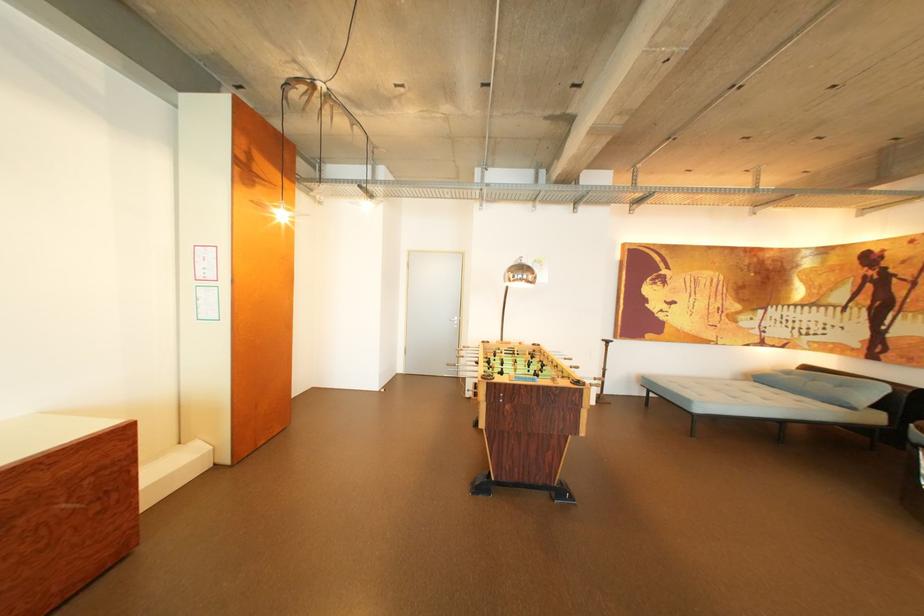
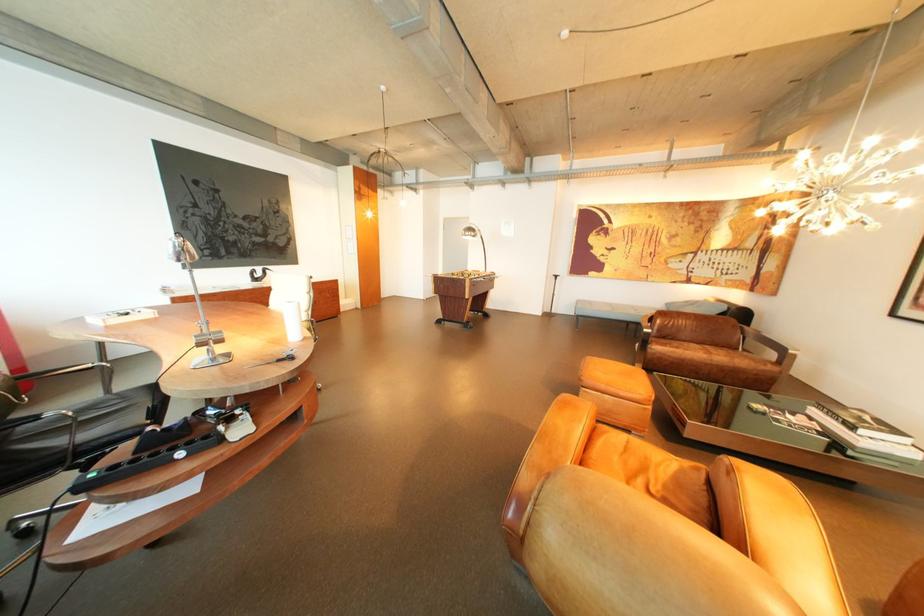
Based on the photo, the images are taken continuously from a first-person perspective. In which direction are you moving?

The cameraman walked toward right, backward.